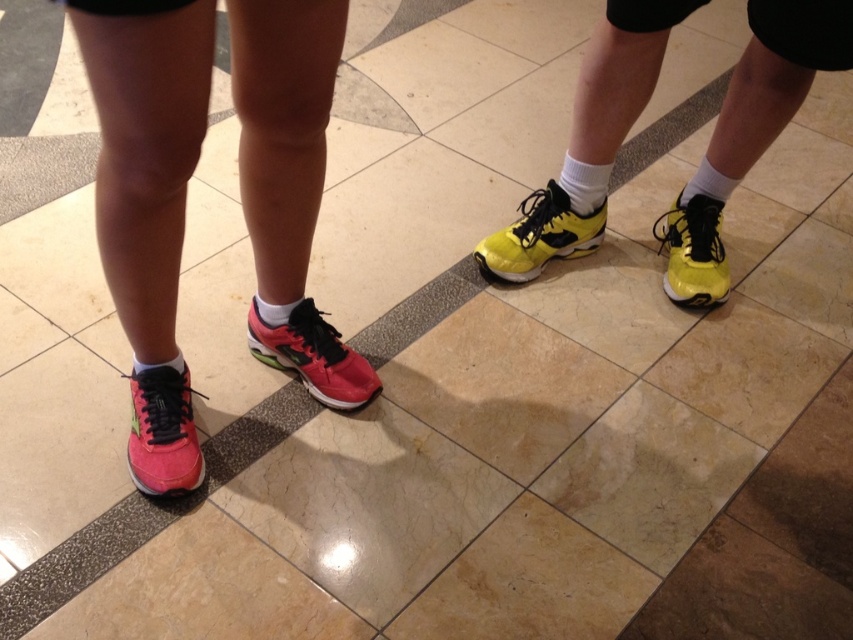
Question: Is yellow matte running shoe at center thinner than white cotton sock at lower right?

Choices:
 (A) yes
 (B) no

Answer: (B)

Question: Can you confirm if matte pink shoe at center is positioned above shiny pink running shoe at lower left?

Choices:
 (A) yes
 (B) no

Answer: (A)

Question: Which is nearer to the white soft sock at lower left?

Choices:
 (A) shiny pink running shoe at lower left
 (B) shiny yellow running shoe at right

Answer: (A)

Question: Can you confirm if pink matte running shoe at lower left is bigger than yellow matte running shoe at center?

Choices:
 (A) yes
 (B) no

Answer: (B)

Question: Which point is farther to the camera?

Choices:
 (A) (285, 323)
 (B) (514, 273)
 (C) (136, 454)
 (D) (625, 61)

Answer: (B)

Question: Among these points, which one is farthest from the camera?

Choices:
 (A) (584, 173)
 (B) (728, 189)
 (C) (535, 218)
 (D) (305, 333)

Answer: (C)